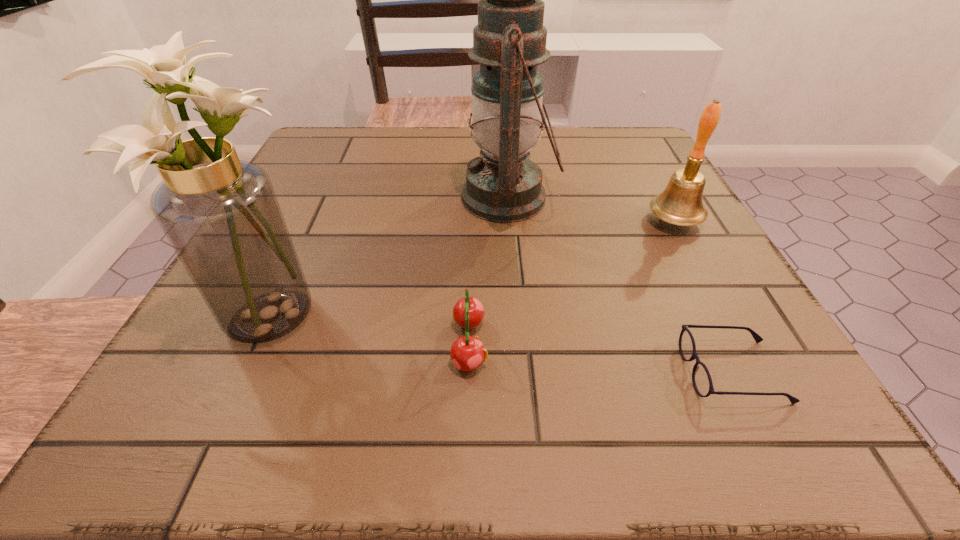
This screenshot has width=960, height=540. Identify the location of free space that is in between the oil lamp and the spectacles. (620, 285).

I want to click on vacant space that is in between the leftmost object and the oil lamp, so click(388, 255).

Identify the location of free area in between the spectacles and the oil lamp. (620, 285).

Locate an element on the screen. The image size is (960, 540). vacant region between the shortest object and the third shortest object is located at coordinates (704, 296).

The image size is (960, 540). In order to click on the fourth closest object to the fourth tallest object in this screenshot , I will do `click(680, 203)`.

This screenshot has width=960, height=540. Identify the location of object that can be found as the fourth closest to the spectacles. (221, 215).

The image size is (960, 540). In order to click on vacant area that satisfies the following two spatial constraints: 1. on the back side of the flower arrangement; 2. on the left side of the bell in this screenshot , I will do `click(312, 221)`.